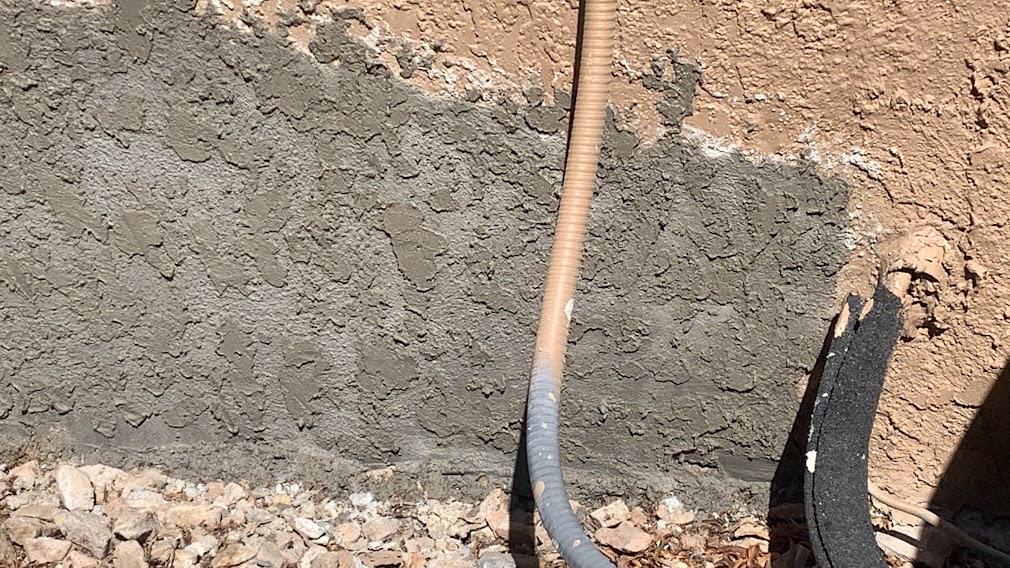
Find the location of a particular element. tan wall is located at coordinates (707, 78).